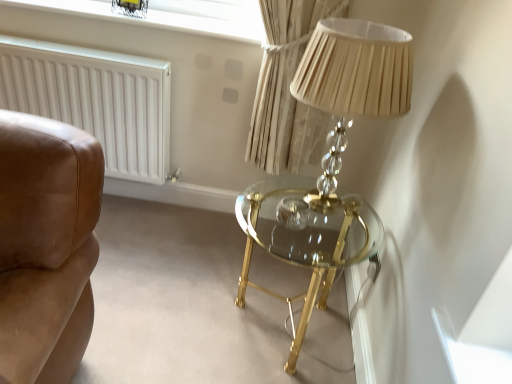
Image resolution: width=512 pixels, height=384 pixels. Describe the element at coordinates (172, 15) in the screenshot. I see `clear glass window screen at upper center` at that location.

Consider the image. What is the approximate width of white matte radiator at left?

It is 5.39 inches.

Identify the location of clear glass window screen at upper center. This screenshot has width=512, height=384. (172, 15).

From a real-world perspective, does gold glass table at center sit lower than white matte radiator at left?

Correct, in the physical world, gold glass table at center is lower than white matte radiator at left.

What's the angular difference between gold glass table at center and white matte radiator at left's facing directions?

gold glass table at center and white matte radiator at left are facing 90.5 degrees away from each other.

Which of these two, gold glass table at center or white matte radiator at left, is thinner?

With smaller width is white matte radiator at left.

Which is behind, clear glass window screen at upper center or white matte radiator at left?

clear glass window screen at upper center is more distant.

Can you confirm if clear glass window screen at upper center is taller than white matte radiator at left?

Incorrect, the height of clear glass window screen at upper center is not larger of that of white matte radiator at left.

Considering the positions of point (122, 17) and point (78, 105), is point (122, 17) closer or farther from the camera than point (78, 105)?

Point (122, 17) is closer to the camera than point (78, 105).

From the image's perspective, which object appears higher, clear glass window screen at upper center or white matte radiator at left?

clear glass window screen at upper center, from the image's perspective.

Between white matte radiator at left and clear glass window screen at upper center, which one has more height?

white matte radiator at left.

Would you consider white matte radiator at left to be distant from clear glass window screen at upper center?

No, white matte radiator at left is not far from clear glass window screen at upper center.

Considering the relative positions of white matte radiator at left and clear glass window screen at upper center in the image provided, is white matte radiator at left to the left of clear glass window screen at upper center from the viewer's perspective?

Correct, you'll find white matte radiator at left to the left of clear glass window screen at upper center.

Is gold glass table at center smaller than clear glass window screen at upper center?

Actually, gold glass table at center might be larger than clear glass window screen at upper center.

Looking at this image, who is shorter, gold glass table at center or clear glass window screen at upper center?

Standing shorter between the two is clear glass window screen at upper center.

Is gold glass table at center positioned with its back to clear glass window screen at upper center?

No, clear glass window screen at upper center is not at the back of gold glass table at center.

From the image's perspective, which one is positioned lower, gold glass table at center or clear glass window screen at upper center?

gold glass table at center, from the image's perspective.

Considering the relative positions of white matte radiator at left and gold glass table at center in the image provided, is white matte radiator at left to the left of gold glass table at center from the viewer's perspective?

Indeed, white matte radiator at left is positioned on the left side of gold glass table at center.

Is gold glass table at center a part of white matte radiator at left?

No, white matte radiator at left does not contain gold glass table at center.

Could you tell me if white matte radiator at left is turned towards gold glass table at center?

No, white matte radiator at left is not aimed at gold glass table at center.

Which object is thinner, white matte radiator at left or gold glass table at center?

white matte radiator at left is thinner.

This screenshot has width=512, height=384. Identify the location of window screen above the gold glass table at center (from the image's perspective). pyautogui.click(x=172, y=15).

Is clear glass window screen at upper center with gold glass table at center?

No, clear glass window screen at upper center is not with gold glass table at center.

Considering the relative sizes of clear glass window screen at upper center and gold glass table at center in the image provided, is clear glass window screen at upper center taller than gold glass table at center?

No, clear glass window screen at upper center is not taller than gold glass table at center.

Is clear glass window screen at upper center wider than gold glass table at center?

No, clear glass window screen at upper center is not wider than gold glass table at center.

The height and width of the screenshot is (384, 512). In order to click on table in front of the white matte radiator at left in this screenshot , I will do `click(306, 242)`.

I want to click on radiator on the left side of clear glass window screen at upper center, so click(95, 100).

Based on the photo, which object lies further to the anchor point gold glass table at center, clear glass window screen at upper center or white matte radiator at left?

clear glass window screen at upper center lies further to gold glass table at center than the other object.

When comparing their distances from clear glass window screen at upper center, does white matte radiator at left or gold glass table at center seem further?

gold glass table at center lies further to clear glass window screen at upper center than the other object.

From the image, which object appears to be nearer to white matte radiator at left, clear glass window screen at upper center or gold glass table at center?

Among the two, clear glass window screen at upper center is located nearer to white matte radiator at left.

Considering their positions, is gold glass table at center positioned further to clear glass window screen at upper center than white matte radiator at left?

gold glass table at center is positioned further to the anchor clear glass window screen at upper center.

Looking at the image, which one is located further to gold glass table at center, white matte radiator at left or clear glass window screen at upper center?

clear glass window screen at upper center is further to gold glass table at center.

Which object lies further to the anchor point white matte radiator at left, gold glass table at center or clear glass window screen at upper center?

gold glass table at center is further to white matte radiator at left.

Find the location of a particular element. The height and width of the screenshot is (384, 512). radiator between clear glass window screen at upper center and gold glass table at center vertically is located at coordinates (95, 100).